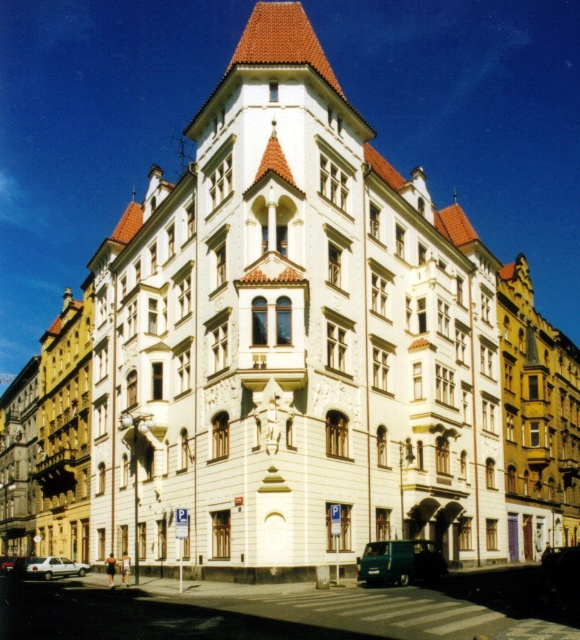
You are standing at the entrance of the building and want to park your car. The parking spot is located at point 0.880, 0.690. Is the green matte van at lower center blocking your path to the parking spot?

The green matte van at lower center is positioned exactly at point (400,563), which is where the parking spot is located. Therefore, the van is blocking the parking spot.

You are a delivery person trying to park your van in the parking lot near the corner building with the cream facade. You see a white matte car at lower left and a silver metallic car at lower left. Which car is blocking your path more?

The white matte car at lower left is positioned over the silver metallic car at lower left, meaning it is closer to your current position and thus blocking your path more.

You are a delivery driver who needs to park your vehicle in this area. You see a green matte van at lower center and a silver metallic car at lower left. Which vehicle is blocking the entrance to the parking area?

The green matte van at lower center is blocking the entrance to the parking area because it is positioned over the silver metallic car at lower left, indicating it is closer to the entrance.